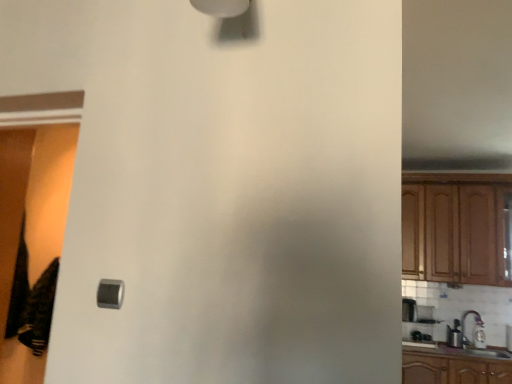
Question: Is point click(x=444, y=248) positioned closer to the camera than point click(x=115, y=296)?

Choices:
 (A) farther
 (B) closer

Answer: (A)

Question: Is wooden cabinet at right in front of or behind satin silver switch at lower left in the image?

Choices:
 (A) behind
 (B) front

Answer: (A)

Question: Which of these objects is positioned farthest from the black fabric screen door at left?

Choices:
 (A) wooden cabinet at right
 (B) black cotton laundry at lower left
 (C) metallic silver toaster at right
 (D) white glossy sink at lower right
 (E) satin silver switch at lower left

Answer: (D)

Question: Estimate the real-world distances between objects in this image. Which object is farther from the white glossy sink at lower right?

Choices:
 (A) black fabric screen door at left
 (B) satin silver switch at lower left
 (C) wooden cabinet at right
 (D) metallic silver toaster at right
 (E) black cotton laundry at lower left

Answer: (B)